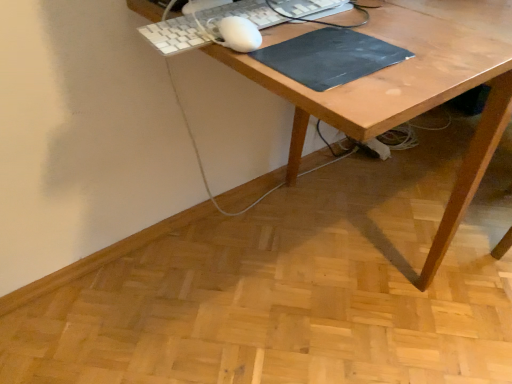
At what (x,y) coordinates should I click in order to perform the action: click on free space to the back side of black matte mousepad at center. Please return your answer as a coordinate pair (x, y). Looking at the image, I should click on (350, 18).